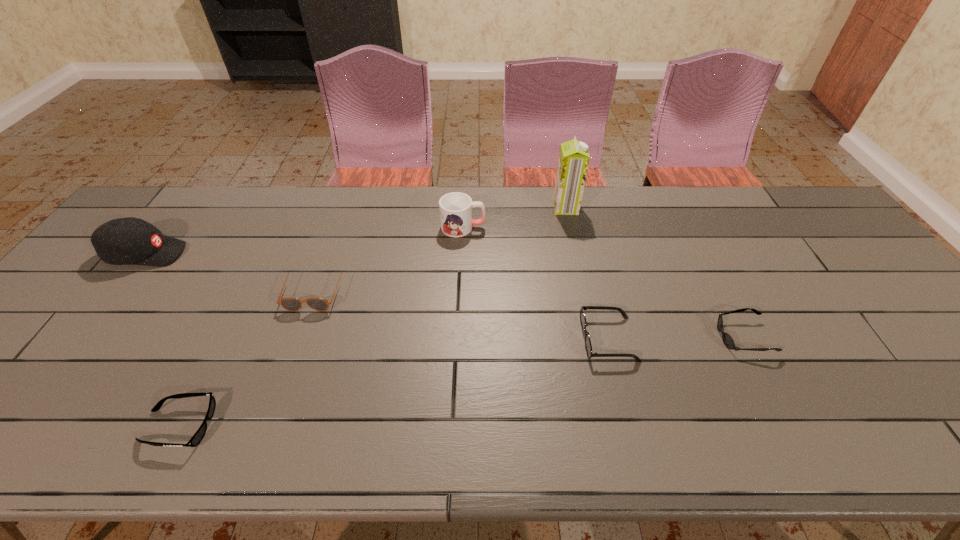
Locate an element on the screen. vacant point located between the rightmost sunglasses and the baseball cap is located at coordinates (444, 295).

Find the location of `free spot between the sixth object from right to left and the fourth object from right to left`. free spot between the sixth object from right to left and the fourth object from right to left is located at coordinates (321, 327).

Locate an element on the screen. vacant region between the tallest object and the third sunglasses from left to right is located at coordinates (587, 273).

The width and height of the screenshot is (960, 540). What are the coordinates of `free space that is in between the soya milk and the baseball cap` in the screenshot? It's located at (356, 231).

Find the location of a particular element. vacant space that is in between the baseball cap and the fourth farthest object is located at coordinates (230, 272).

Where is `free space between the leftmost object and the soya milk`? This screenshot has height=540, width=960. free space between the leftmost object and the soya milk is located at coordinates (356, 231).

This screenshot has width=960, height=540. Find the location of `free space that is in between the rightmost sunglasses and the second sunglasses from right to left`. free space that is in between the rightmost sunglasses and the second sunglasses from right to left is located at coordinates (676, 338).

You are a GUI agent. You are given a task and a screenshot of the screen. Output one action in this format:
    pyautogui.click(x=<x>, y=<y>)
    Task: Click on the free space between the third sunglasses from left to right and the rightmost sunglasses
    The image size is (960, 540).
    Given the screenshot: What is the action you would take?
    pyautogui.click(x=676, y=338)

This screenshot has height=540, width=960. I want to click on empty location between the tallest object and the mug, so click(x=515, y=218).

Find the location of a particular element. The image size is (960, 540). object that is the second closest to the second sunglasses from right to left is located at coordinates (455, 208).